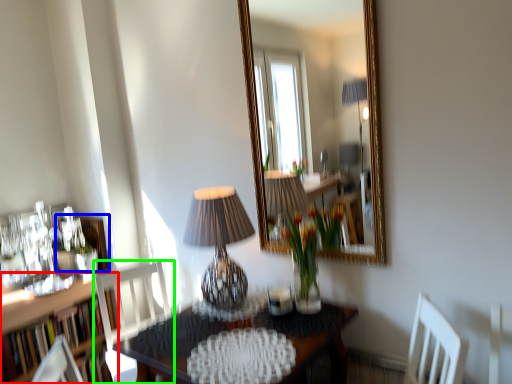
Question: Which is farther away from bookcase (highlighted by a red box)? picture frame (highlighted by a blue box) or chair (highlighted by a green box)?

Choices:
 (A) picture frame
 (B) chair

Answer: (A)